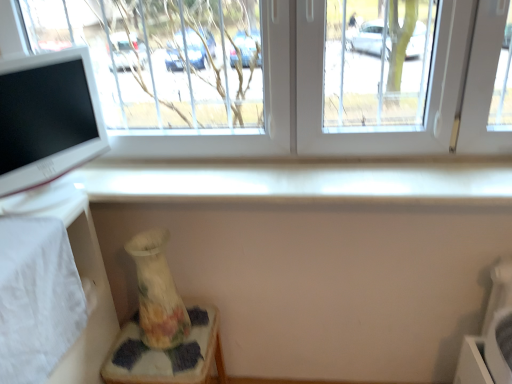
The height and width of the screenshot is (384, 512). I want to click on vacant space situated above porcelain floral vase at lower left (from a real-world perspective), so click(x=168, y=347).